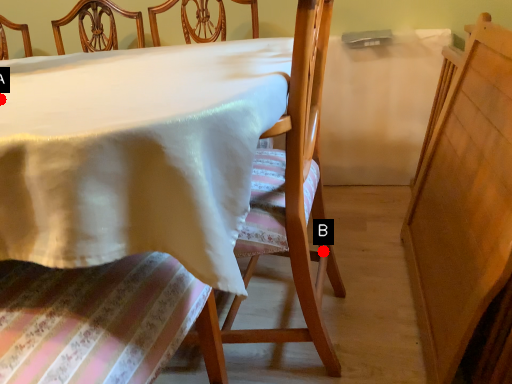
Question: Two points are circled on the image, labeled by A and B beside each circle. Which point is farther from the camera taking this photo?

Choices:
 (A) A is further
 (B) B is further

Answer: (B)